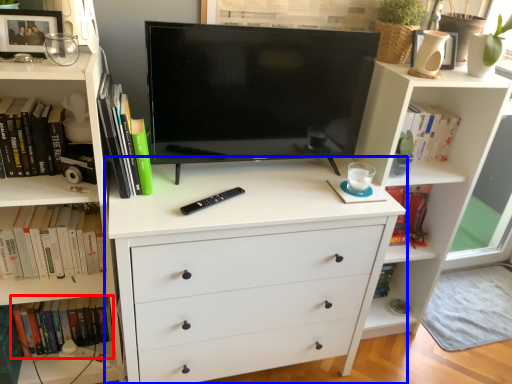
Question: Which object is further to the camera taking this photo, book (highlighted by a red box) or chest of drawers (highlighted by a blue box)?

Choices:
 (A) book
 (B) chest of drawers

Answer: (A)